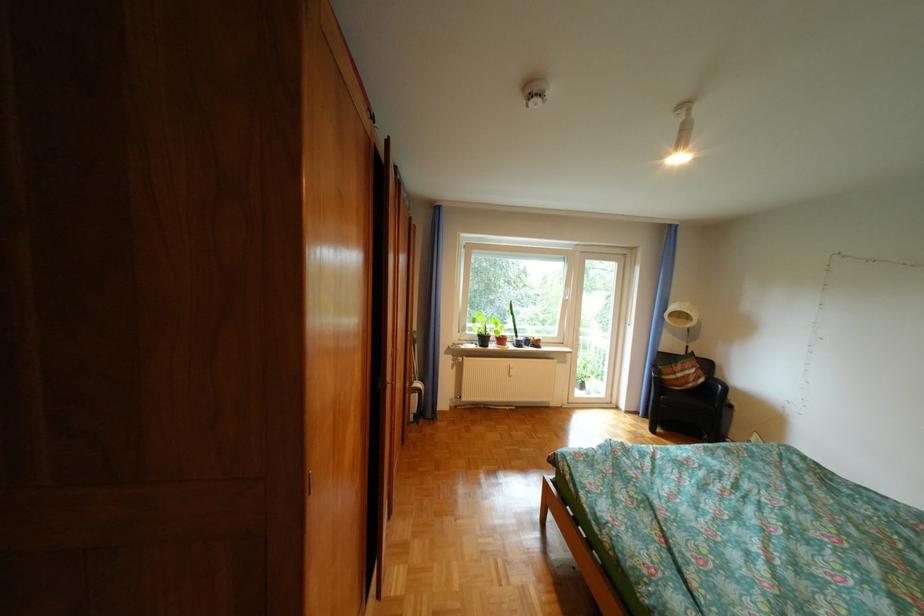
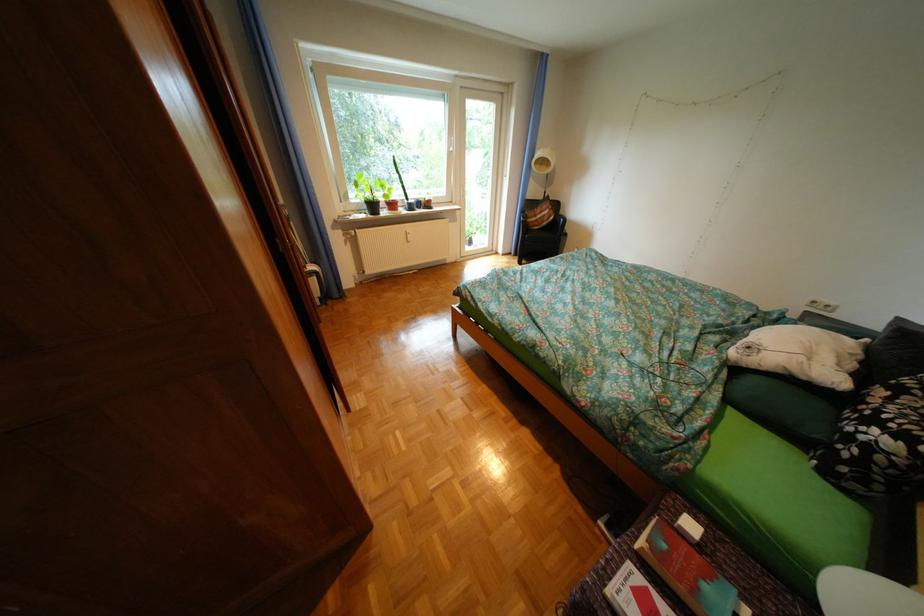
The point at (699, 403) is marked in the first image. Where is the corresponding point in the second image?

(555, 238)